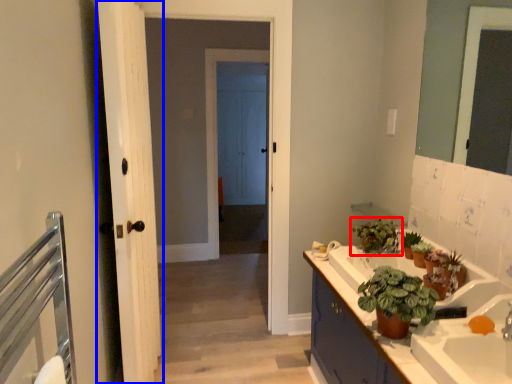
Question: Which point is further to the camera, houseplant (highlighted by a red box) or door (highlighted by a blue box)?

Choices:
 (A) houseplant
 (B) door

Answer: (A)